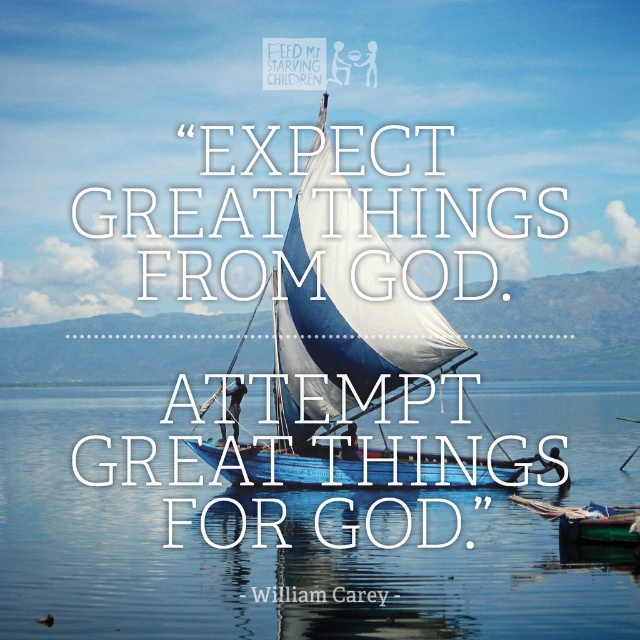
You are a photographer planning to capture the blue fabric sailboat at center and the transparent blue water at center in a single shot. Based on the scene, which object will occupy more horizontal space in the photo?

The transparent blue water at center has a greater width than the blue fabric sailboat at center, so it will occupy more horizontal space in the photo.

Consider the image. You are navigating a small boat on the lake and need to reach a destination marked by point (1, 448). There is an obstacle at point (285, 326). Based on the scene description, will you pass the obstacle before or after reaching your destination?

Since point (1, 448) is behind point (285, 326), you will reach the destination after passing the obstacle.